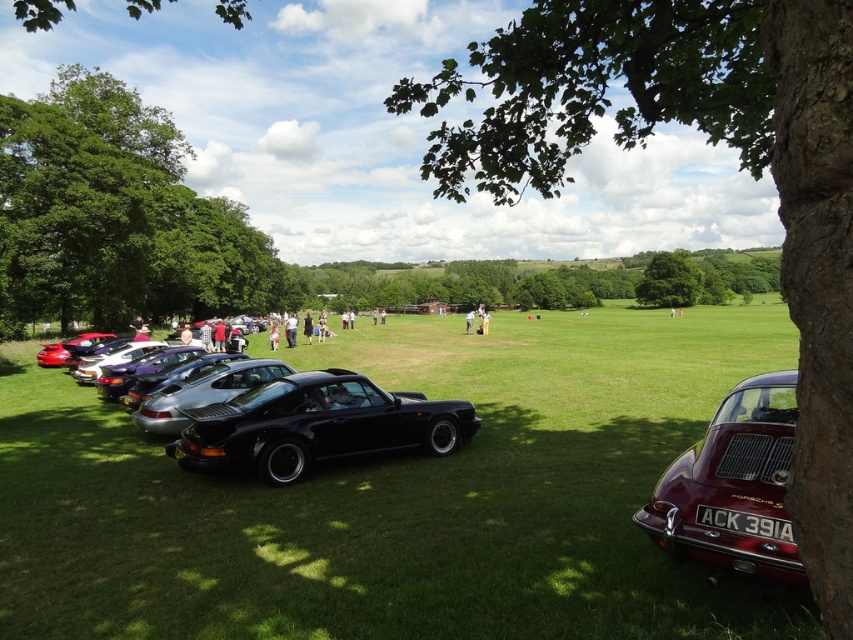
Question: Which of the following is the farthest from the observer?

Choices:
 (A) (129, 365)
 (B) (132, 342)
 (C) (292, 339)
 (D) (519, 513)

Answer: (C)

Question: Which point is farther to the camera?

Choices:
 (A) green leafy tree at center
 (B) glossy metallic cars at lower left

Answer: (A)

Question: Can you confirm if black glossy car at center is positioned to the right of satin black car at center?

Choices:
 (A) no
 (B) yes

Answer: (B)

Question: Is satin black car at center to the left of glossy metallic cars at lower left from the viewer's perspective?

Choices:
 (A) no
 (B) yes

Answer: (A)

Question: Which point is closer to the camera?

Choices:
 (A) pos(160,356)
 (B) pos(657,81)
 (C) pos(128,200)

Answer: (B)

Question: Is metallic purple car at lower left thinner than dark blue dress at center?

Choices:
 (A) yes
 (B) no

Answer: (A)